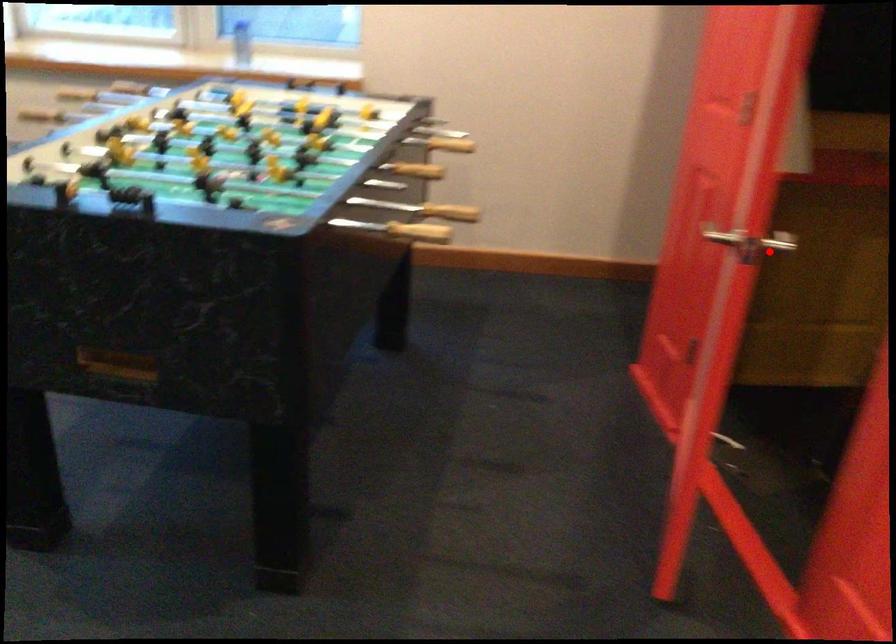
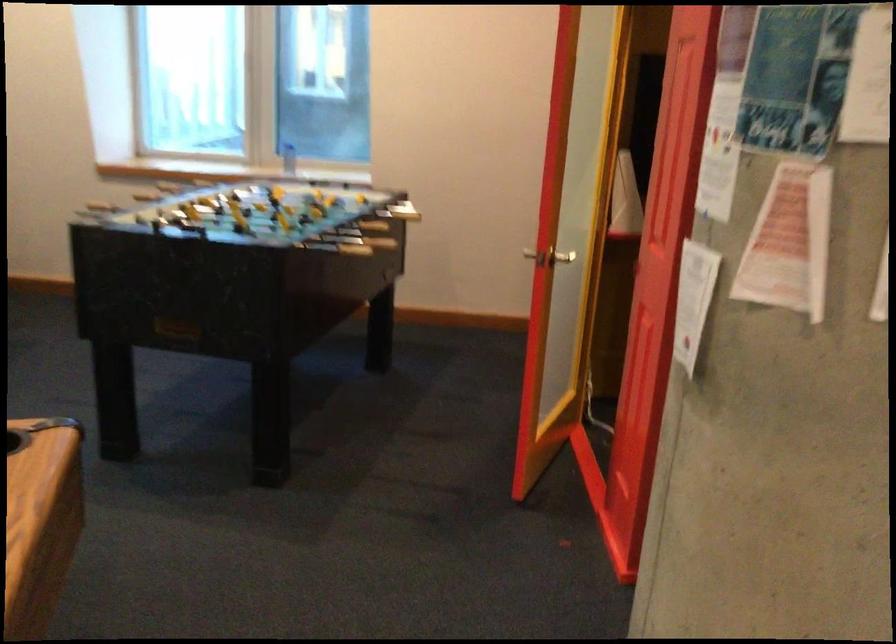
The point at the highlighted location is marked in the first image. Where is the corresponding point in the second image?

(562, 257)